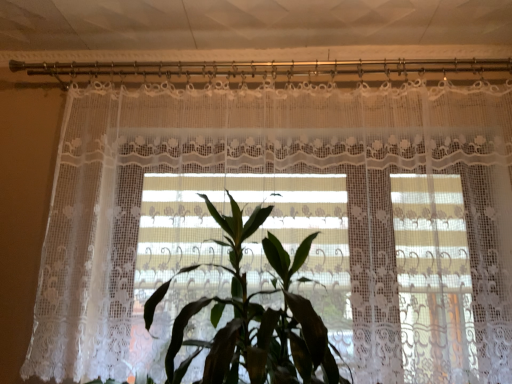
In the scene shown: Measure the distance between green leafy plant at center and camera.

green leafy plant at center is 1.11 meters away from camera.

Describe the element at coordinates (253, 317) in the screenshot. This screenshot has height=384, width=512. I see `green leafy plant at center` at that location.

At what (x,y) coordinates should I click in order to perform the action: click on green leafy plant at center. Please return your answer as a coordinate pair (x, y). Looking at the image, I should click on (253, 317).

Where is `green leafy plant at center`? green leafy plant at center is located at coordinates [x=253, y=317].